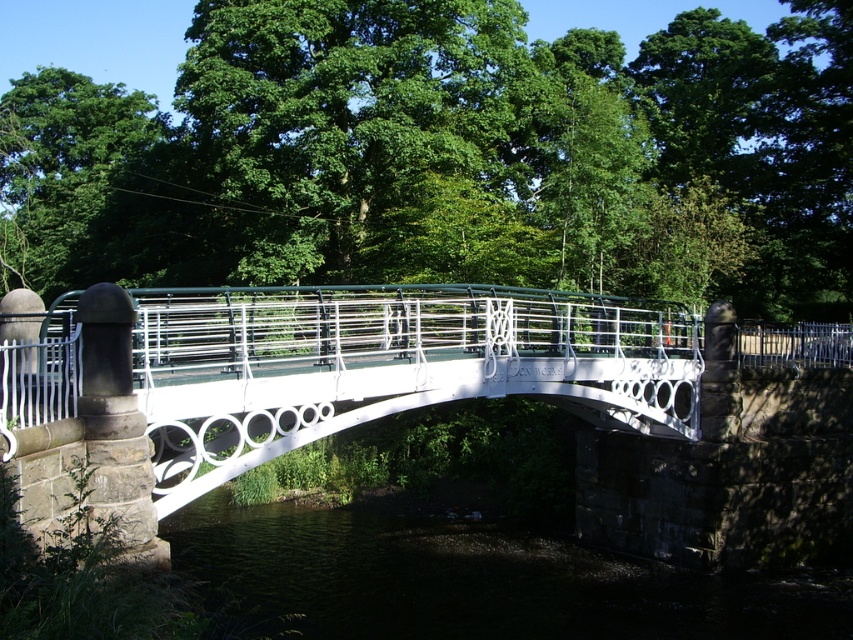
You are standing on the left side of the white matte pedestrian bridge at center. You want to cross to the right side. Which direction should you walk to reach the dark water at lower center?

Since the white matte pedestrian bridge at center is to the left of dark water at lower center, you should walk to the right along the white matte pedestrian bridge at center to reach the dark water at lower center.

You are a delivery drone carrying a package that requires a minimum clearance of 5 meters to pass safely. You need to fly over the white matte pedestrian bridge at center and the dark water at lower center. Based on the scene, can you safely pass through this area?

The white matte pedestrian bridge at center and dark water at lower center are 4.79 meters apart from each other, which is less than the required 5 meters clearance. Therefore, the delivery drone cannot safely pass through this area.